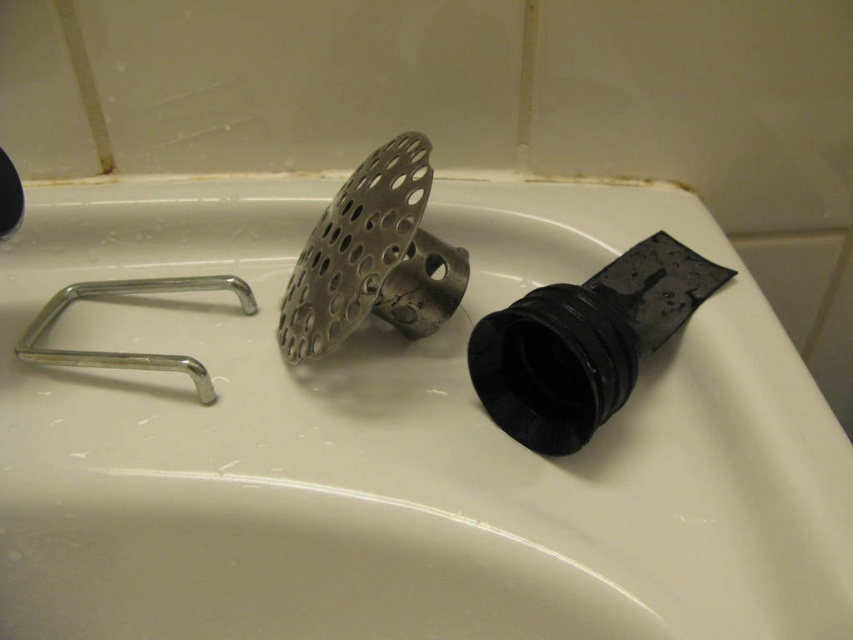
Question: Which object is farther from the camera taking this photo?

Choices:
 (A) white matte sink at center
 (B) silver metallic faucet at left

Answer: (B)

Question: Among these objects, which one is farthest from the camera?

Choices:
 (A) silver metallic faucet at left
 (B) white matte sink at center

Answer: (A)

Question: Is white matte sink at center bigger than silver metallic faucet at left?

Choices:
 (A) yes
 (B) no

Answer: (A)

Question: Which point is closer to the camera taking this photo?

Choices:
 (A) (172, 557)
 (B) (155, 365)

Answer: (A)

Question: Is white matte sink at center in front of silver metallic faucet at left?

Choices:
 (A) no
 (B) yes

Answer: (B)

Question: Can you confirm if white matte sink at center is positioned to the left of silver metallic faucet at left?

Choices:
 (A) no
 (B) yes

Answer: (A)